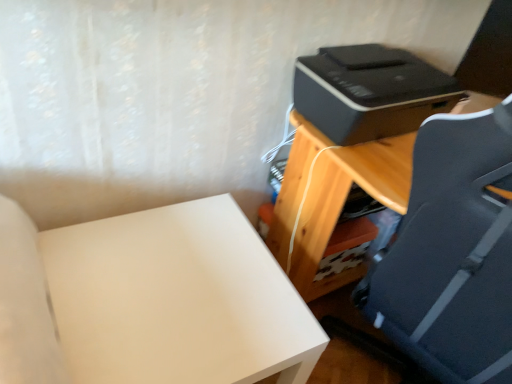
The width and height of the screenshot is (512, 384). I want to click on empty space that is ontop of white matte table at lower left (from a real-world perspective), so click(x=172, y=282).